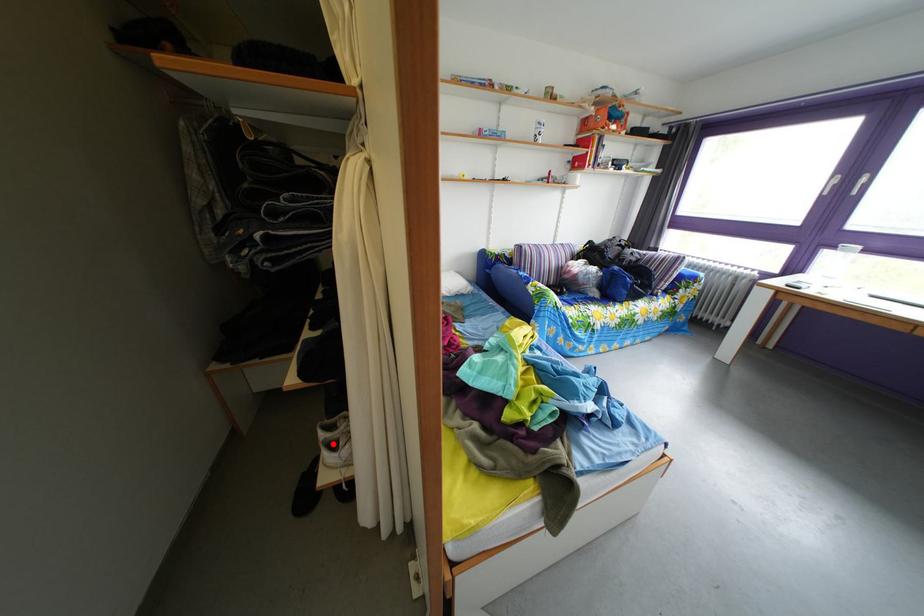
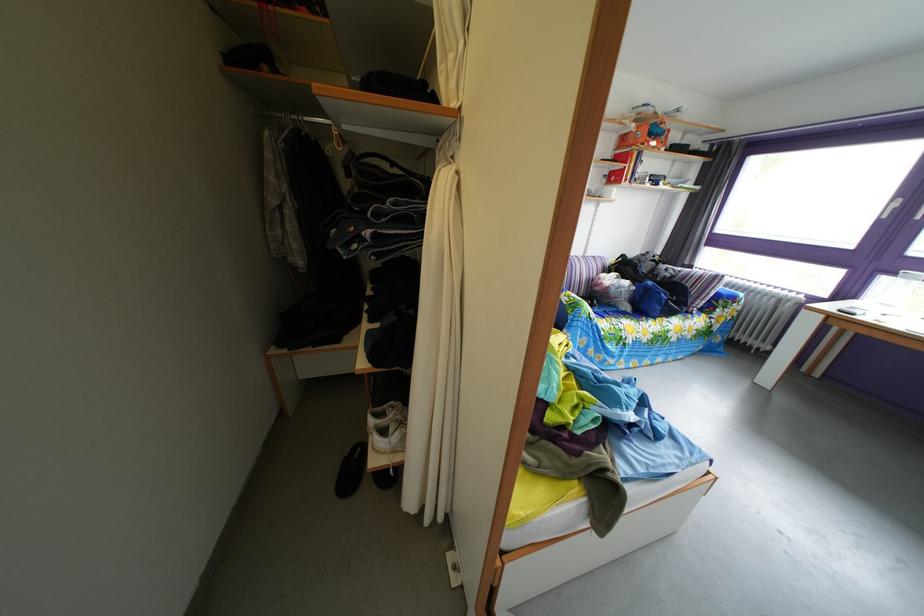
Locate, in the second image, the point that corresponds to the highlighted location in the first image.

(383, 430)